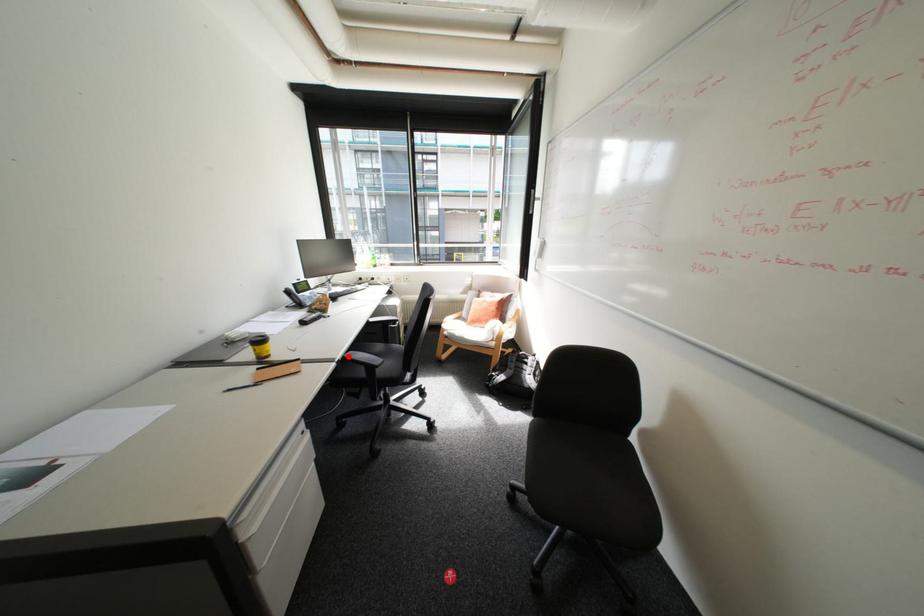
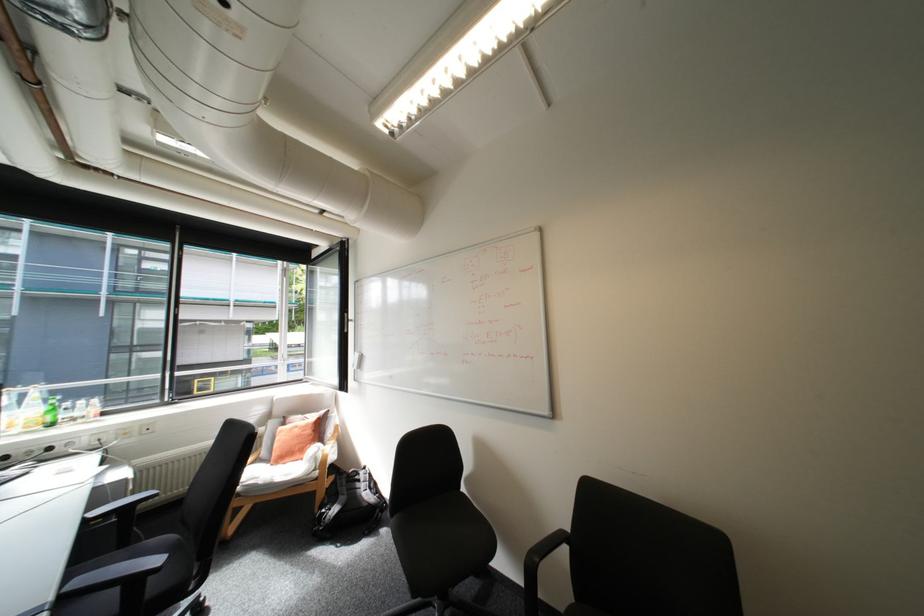
Question: I am providing you with two images of the same scene from different viewpoints. In image1, a red point is highlighted. Considering the same 3D point in image2, which of the following is correct?

Choices:
 (A) It is closer
 (B) It is farther

Answer: (B)